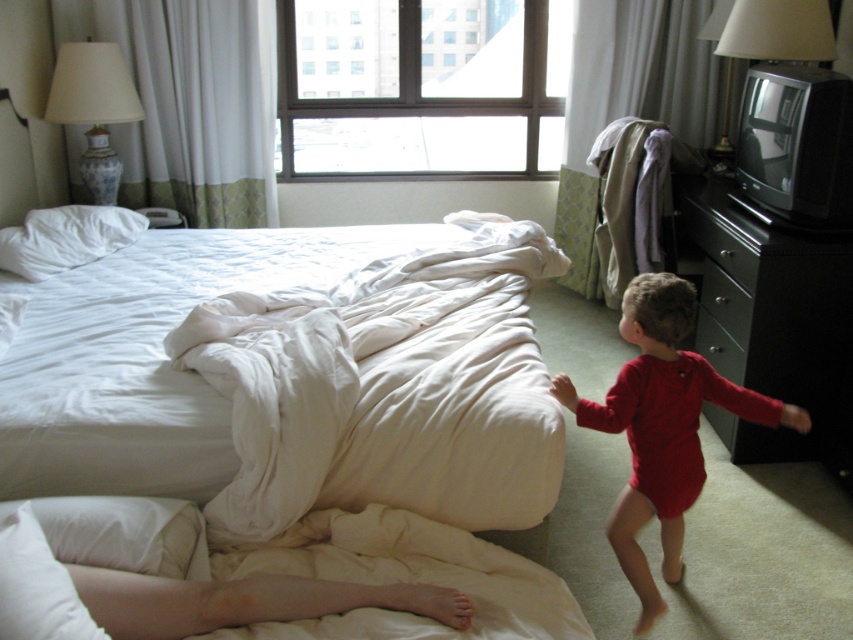
Question: Which object is positioned farthest from the metallic silver lamp at upper right?

Choices:
 (A) black glossy dresser at right
 (B) red smooth onesie at right

Answer: (B)

Question: Can you confirm if white soft bed at center is positioned above metallic silver drawer at right?

Choices:
 (A) no
 (B) yes

Answer: (A)

Question: Where is white soft pillow at lower left located in relation to metallic silver lamp at upper right in the image?

Choices:
 (A) left
 (B) right

Answer: (A)

Question: Which object appears closest to the camera in this image?

Choices:
 (A) white quilted pillow at upper left
 (B) porcelain lampshade at upper left
 (C) white soft pillow at lower left
 (D) metallic silver drawer at right

Answer: (C)

Question: Is red smooth onesie at right below metallic silver drawer at right?

Choices:
 (A) yes
 (B) no

Answer: (A)

Question: Among these objects, which one is farthest from the camera?

Choices:
 (A) white soft pillow at lower left
 (B) white quilted pillow at upper left
 (C) metallic silver lamp at upper right
 (D) black glossy dresser at right

Answer: (C)